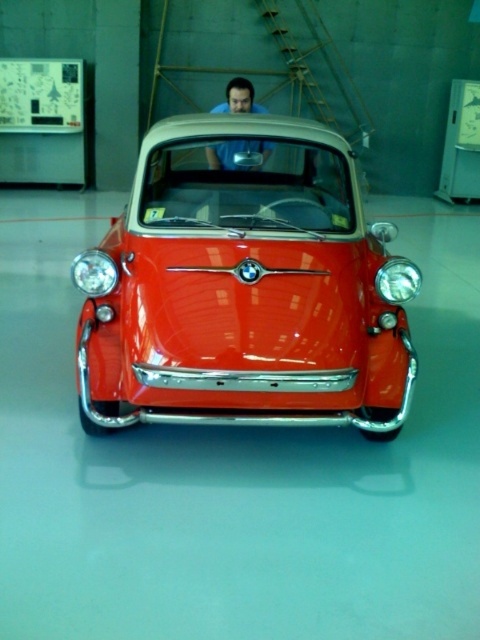
From the picture: You are standing in the showroom and want to take a photo of the shiny red car at center without the blue matte shirt at center appearing in the background. Is the current position possible?

The shiny red car at center is in front of the blue matte shirt at center, so if you position yourself so that the car is between you and the shirt, the shirt will not be visible in the background. However, if the shirt is behind the car, you might still see parts of it depending on the angle. To ensure the shirt is not in the photo, move to a position where the car fully blocks the view of the shirt.

You are a photographer setting up a shoot in the showroom. You need to position a light source to highlight the shiny red car at center without casting a shadow from the blue matte shirt at center. Where should you place the light source relative to the two objects?

The shiny red car at center is positioned under blue matte shirt at center. To avoid casting a shadow from the blue matte shirt at center on the car, the light source should be placed above the blue matte shirt at center so that the light falls directly onto the shiny red car at center without obstruction.

You are standing in a showroom and see the shiny red car at center and the blue matte shirt at center. Which object is positioned to the right of the other?

The shiny red car at center is positioned to the right of the blue matte shirt at center.